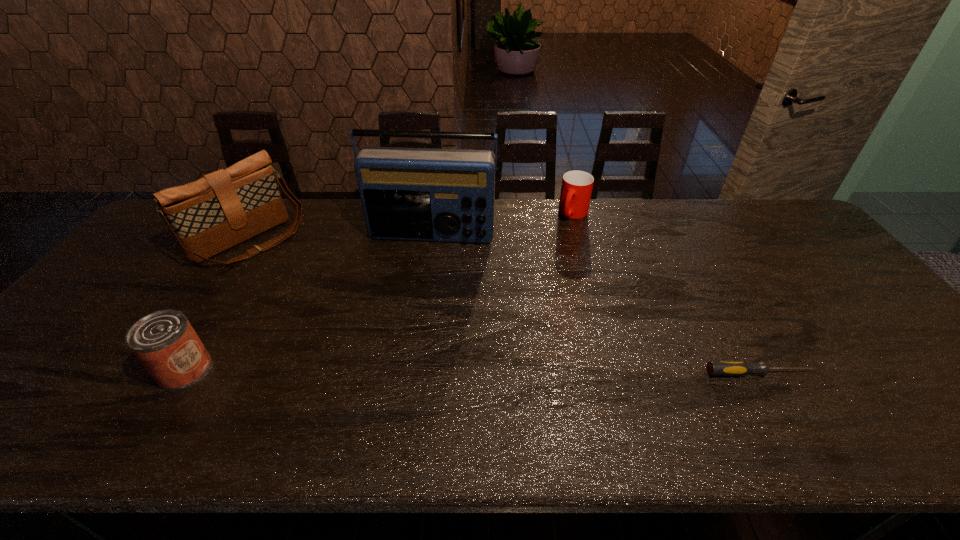
Find the location of `shoulder bag located in the far edge section of the desktop`. shoulder bag located in the far edge section of the desktop is located at coordinates (224, 208).

Locate an element on the screen. can present at the near edge is located at coordinates (164, 341).

Where is `screwdriver at the near edge`? Image resolution: width=960 pixels, height=540 pixels. screwdriver at the near edge is located at coordinates (715, 368).

The width and height of the screenshot is (960, 540). I want to click on free space at the far edge of the desktop, so click(x=610, y=213).

In the image, there is a desktop. Where is `blank space at the near edge`? The height and width of the screenshot is (540, 960). blank space at the near edge is located at coordinates (173, 392).

I want to click on vacant space at the left edge, so click(73, 331).

Locate an element on the screen. The width and height of the screenshot is (960, 540). vacant point at the right edge is located at coordinates (845, 291).

Where is `vacant area that lies between the cup and the radio receiver`? The height and width of the screenshot is (540, 960). vacant area that lies between the cup and the radio receiver is located at coordinates (503, 225).

Locate an element on the screen. unoccupied area between the shortest object and the tallest object is located at coordinates (595, 304).

You are a GUI agent. You are given a task and a screenshot of the screen. Output one action in this format:
    pyautogui.click(x=<x>, y=<y>)
    Task: Click on the free space between the shortest object and the can
    
    Given the screenshot: What is the action you would take?
    pyautogui.click(x=471, y=371)